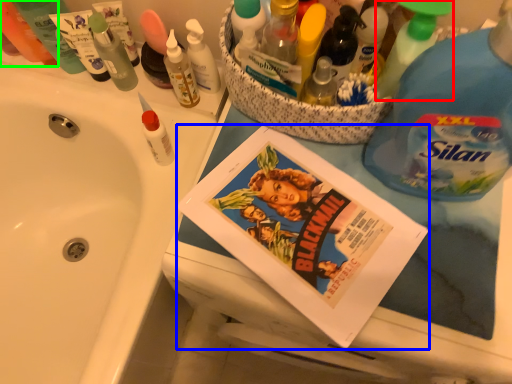
Question: Considering the real-world distances, which object is farthest from cleaning product (highlighted by a red box)? comic book (highlighted by a blue box) or toiletry (highlighted by a green box)?

Choices:
 (A) comic book
 (B) toiletry

Answer: (B)